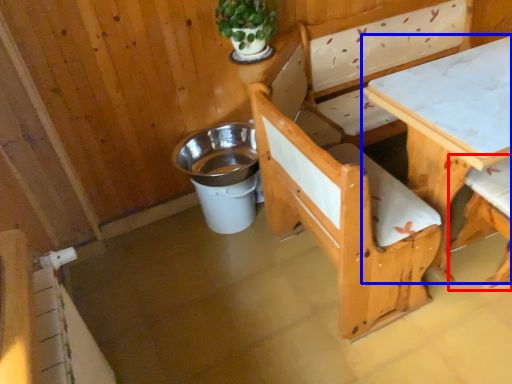
Question: Among these objects, which one is nearest to the camera, chair (highlighted by a red box) or table (highlighted by a blue box)?

Choices:
 (A) chair
 (B) table

Answer: (B)